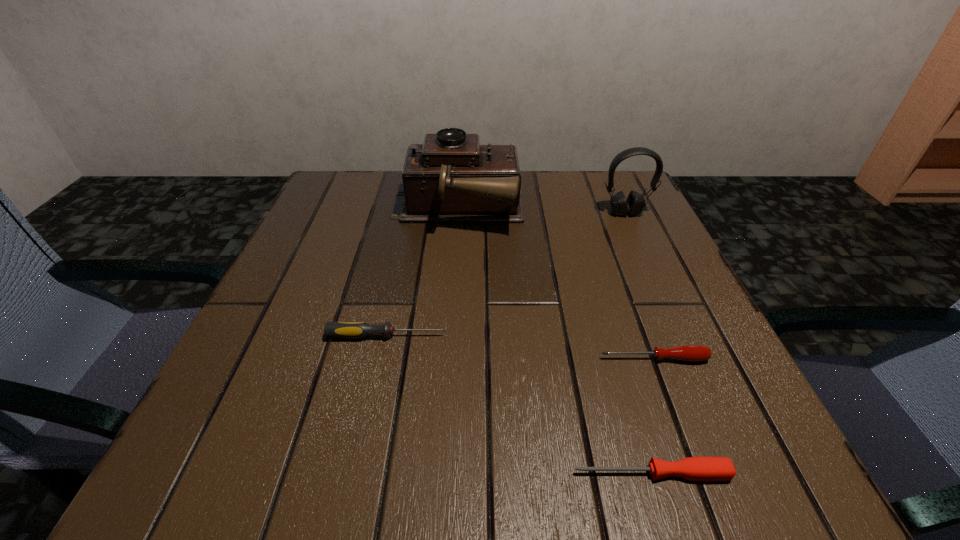
Find the location of a particular element. The width and height of the screenshot is (960, 540). vacant space that satisfies the following two spatial constraints: 1. on the back side of the second nearest screwdriver; 2. on the horn of the phonograph_record is located at coordinates (599, 211).

Identify the location of vacant space that satisfies the following two spatial constraints: 1. on the back side of the second farthest screwdriver; 2. insert the third farthest object into a screw head. The height and width of the screenshot is (540, 960). (645, 336).

Where is `vacant area in the image that satisfies the following two spatial constraints: 1. on the back side of the fourth farthest object; 2. on the horn of the phonograph_record`? This screenshot has width=960, height=540. vacant area in the image that satisfies the following two spatial constraints: 1. on the back side of the fourth farthest object; 2. on the horn of the phonograph_record is located at coordinates (599, 211).

I want to click on vacant point that satisfies the following two spatial constraints: 1. insert the leftmost screwdriver into a screw head; 2. on the back side of the second farthest screwdriver, so click(382, 359).

Image resolution: width=960 pixels, height=540 pixels. I want to click on free region that satisfies the following two spatial constraints: 1. insert the second nearest object into a screw head; 2. on the left side of the leftmost screwdriver, so click(x=382, y=359).

At what (x,y) coordinates should I click in order to perform the action: click on vacant area that satisfies the following two spatial constraints: 1. insert the second farthest screwdriver into a screw head; 2. on the left side of the farthest screwdriver. Please return your answer as a coordinate pair (x, y). Looking at the image, I should click on (382, 359).

Find the location of `vacant point that satisfies the following two spatial constraints: 1. on the horn of the second farthest screwdriver; 2. on the left side of the phonograph_record`. vacant point that satisfies the following two spatial constraints: 1. on the horn of the second farthest screwdriver; 2. on the left side of the phonograph_record is located at coordinates (446, 359).